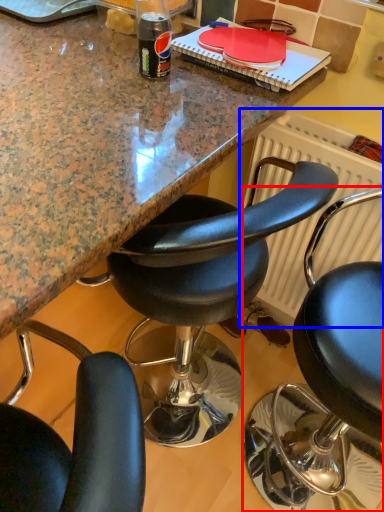
Question: Among these objects, which one is farthest to the camera, chair (highlighted by a red box) or radiator (highlighted by a blue box)?

Choices:
 (A) chair
 (B) radiator

Answer: (B)